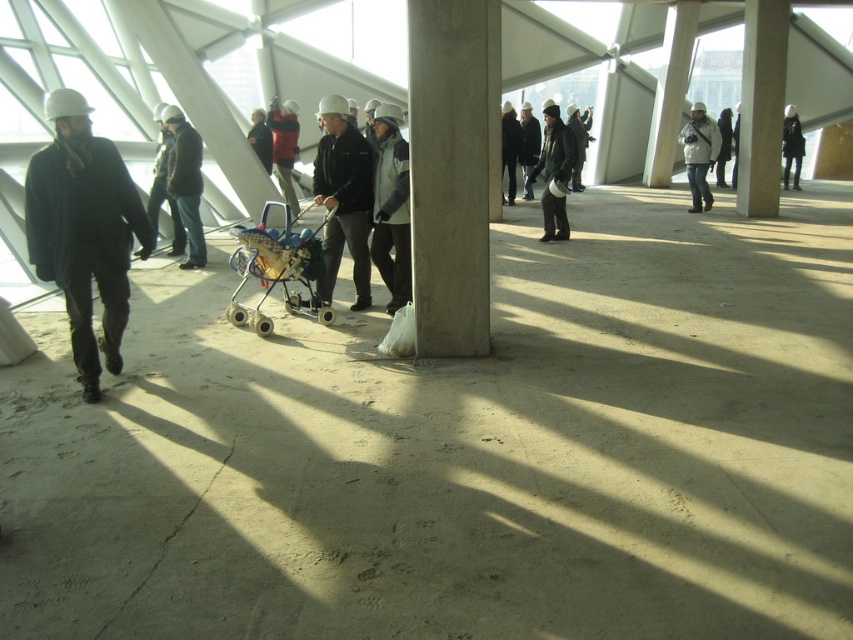
You are standing at the point marked by coordinates point [277,268]. Looking around, you see a blue plastic baby carriage at center. What object is located at your current position?

The point marked by coordinates point [277,268] indicates the location of the blue plastic baby carriage at center.

You are a delivery person standing at the entrance of the building. You need to deliver a package to the person wearing the matte black jacket at center. There is a blue plastic baby carriage at center blocking your path. Can you safely navigate around the baby carriage to reach the person?

The matte black jacket at center is 43.55 centimeters away from the blue plastic baby carriage at center. Since the distance between them is relatively narrow, you would need to carefully maneuver around the baby carriage to reach the person. However, the tight space might make it challenging, so proceed with caution.

You are a delivery person trying to navigate through the indoor area. You see a matte black jacket at center and a blue plastic baby carriage at center. Which object is blocking your path more?

The matte black jacket at center is positioned over the blue plastic baby carriage at center, so the matte black jacket at center is blocking the path more.